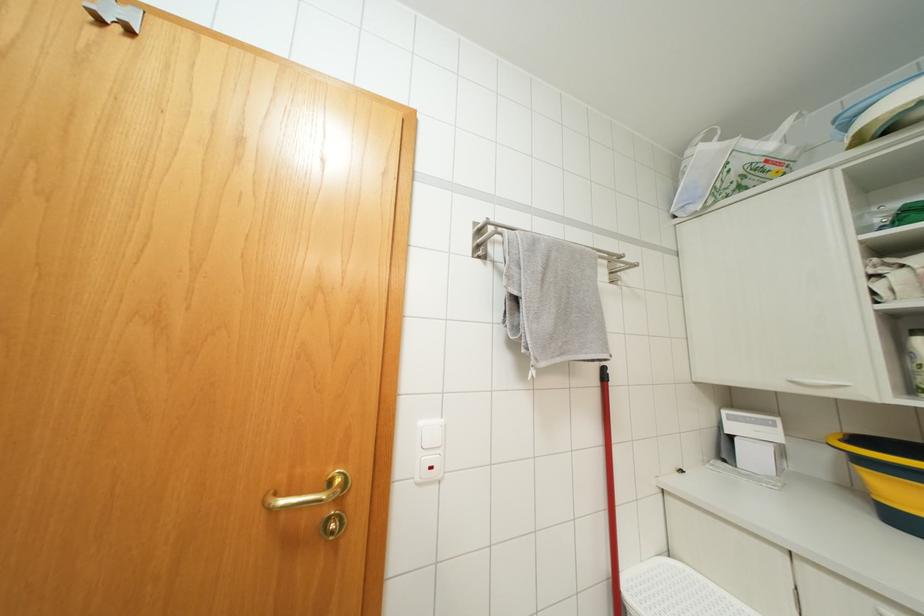
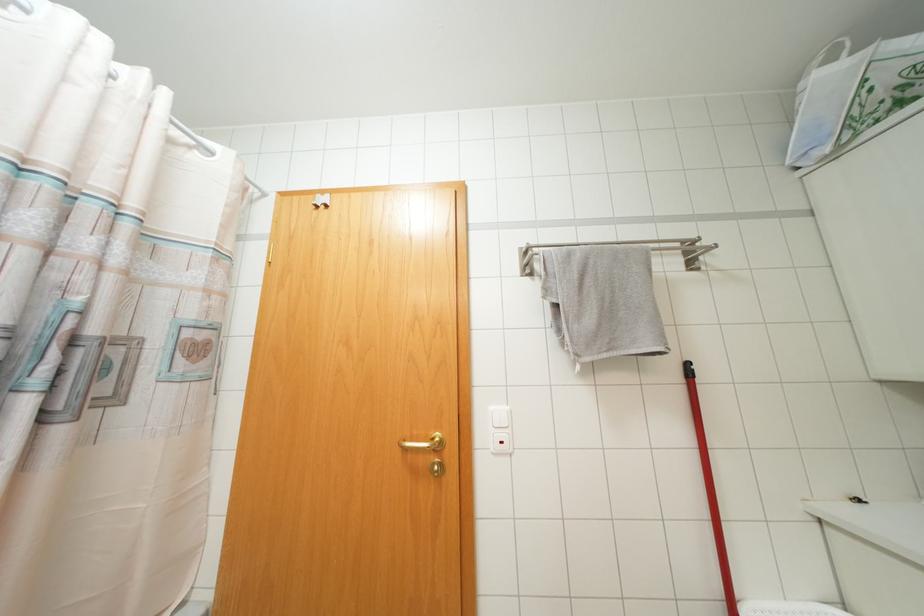
What movement of the cameraman would produce the second image?

The cameraman walked toward right, backward.